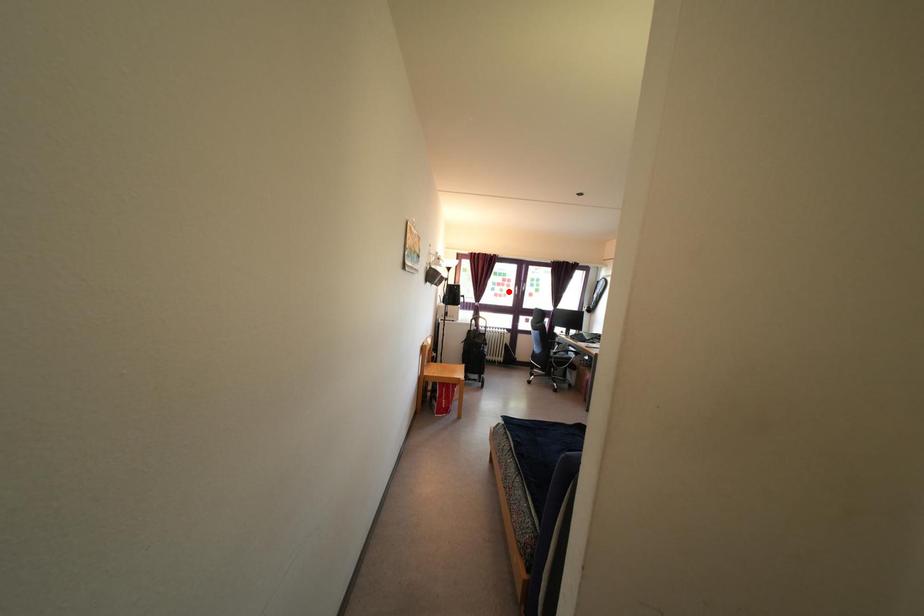
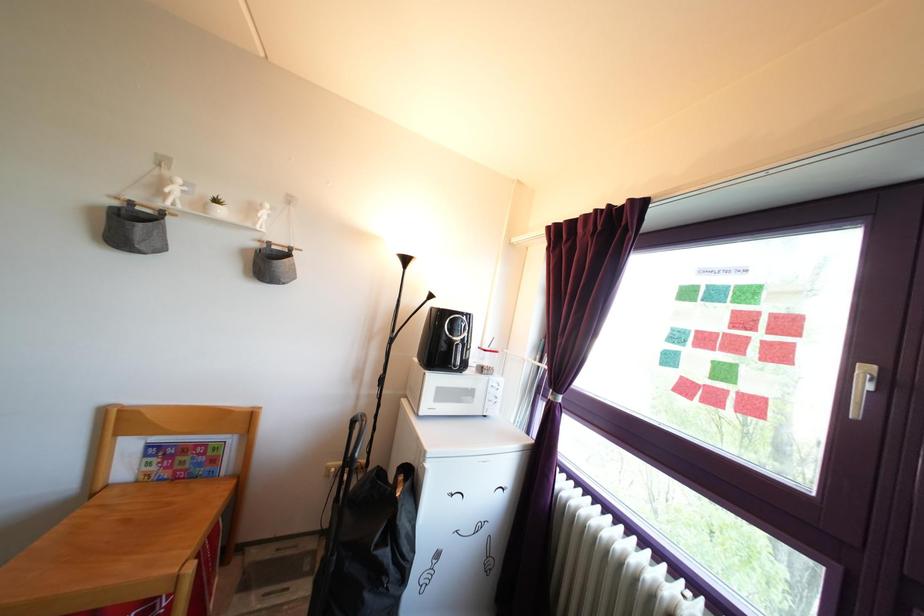
Locate, in the second image, the point that corresponds to the highlighted location in the first image.

(761, 345)